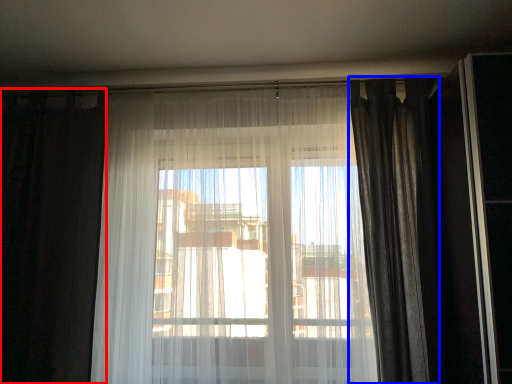
Question: Which object appears farthest to the camera in this image, curtain (highlighted by a red box) or curtain (highlighted by a blue box)?

Choices:
 (A) curtain
 (B) curtain

Answer: (A)